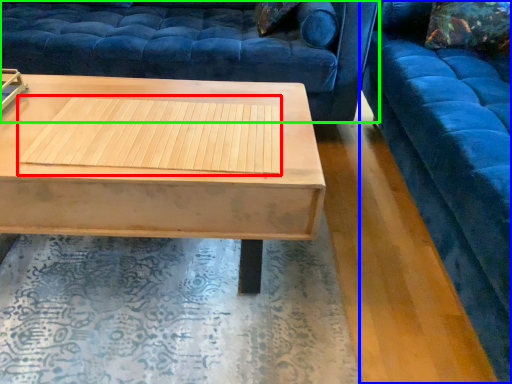
Question: Estimate the real-world distances between objects in this image. Which object is farther from wood (highlighted by a red box), studio couch (highlighted by a blue box) or studio couch (highlighted by a green box)?

Choices:
 (A) studio couch
 (B) studio couch

Answer: (A)